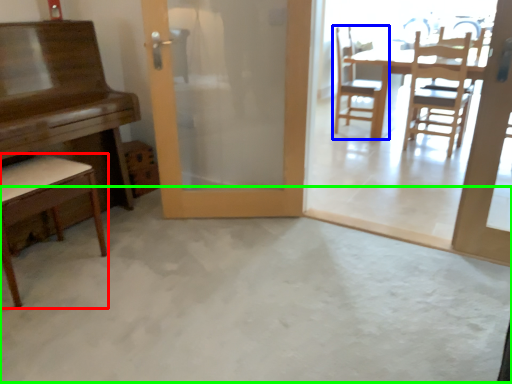
Question: Which object is positioned closest to chair (highlighted by a red box)? Select from chair (highlighted by a blue box) and concrete (highlighted by a green box).

Choices:
 (A) chair
 (B) concrete

Answer: (B)